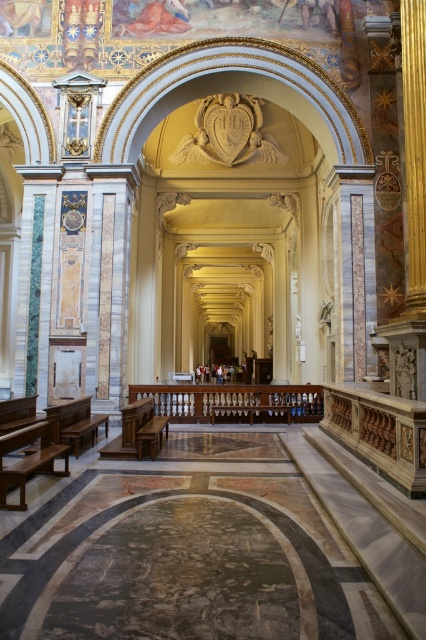
You are an architect examining the cathedral layout. You need to determine the spatial relationship between the polished wood bench at center and the brown polished wood bench at lower left. Which bench is located above the other?

The polished wood bench at center is positioned under the brown polished wood bench at lower left, meaning the brown polished wood bench at lower left is above it.

You are a tour guide leading a group through the cathedral. You need to move a 24 inch wide decorative vase from the wooden bench at lower left to the brown polished wood bench at lower left. Can you fit the vase between the two benches without moving either bench?

The distance between the wooden bench at lower left and brown polished wood bench at lower left is 25.17 inches. Since the vase is 24 inches wide, it can fit between them as the space is slightly larger than the vase.

You are an architect visiting the cathedral and need to place a 1.2 meter tall sculpture between the wooden bench at lower left and the polished wood bench at center. Can the sculpture be placed there without exceeding the height of either bench?

The wooden bench at lower left is taller than the polished wood bench at center. Since the sculpture is 1.2 meters tall, it must be shorter than both benches. However, since the wooden bench at lower left is taller than the polished one, the sculpture can be placed between them as long as it is shorter than the shorter bench. However, without knowing the exact heights, we cannot confirm. But according to the description, the wooden bench at lower left is taller, so if the sculpture is 1.2m, it needs to be <